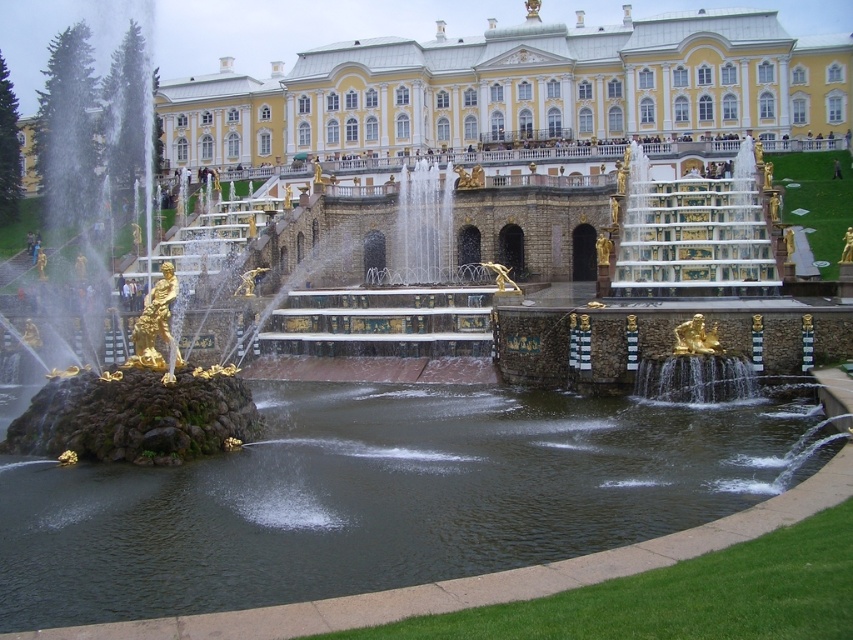
You are standing in the garden and want to take a photo of the white glossy palace at center. Based on its position, in which general area of the image should you aim your camera?

The white glossy palace at center is located at point coordinates approximately 0.141 on the x axis and 0.608 on the y axis, so you should aim your camera towards the lower left section of the image to capture it properly.

You are a tourist visiting the garden and want to take a photo that includes both the white glossy palace at center and the dark brown stone fountain at center. Given their sizes, which one should you position closer to the camera to ensure both are visible in the frame?

The white glossy palace at center is larger than the dark brown stone fountain at center. To ensure both are visible in the frame, you should position the dark brown stone fountain at center closer to the camera since it is smaller and the larger palace can be placed further back to balance the composition.

You are a tourist standing at the edge of the garden, and you want to take a photo of the white glossy palace at center. The camera you have can focus on objects up to 100 meters away. Will the palace be in focus?

The white glossy palace at center is 102.21 meters away from the camera, which exceeds the camera maximum focusing distance of 100 meters. Therefore, the palace will not be in focus.